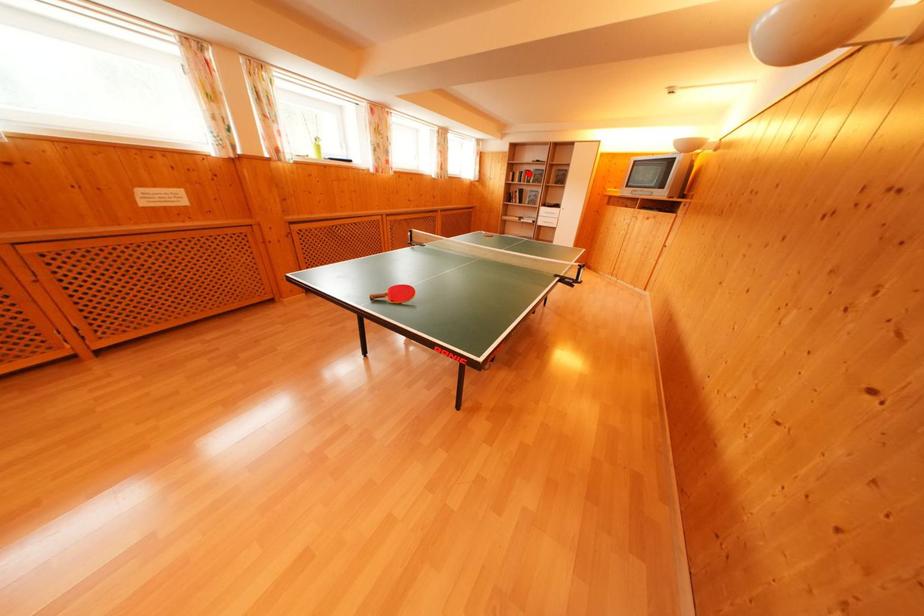
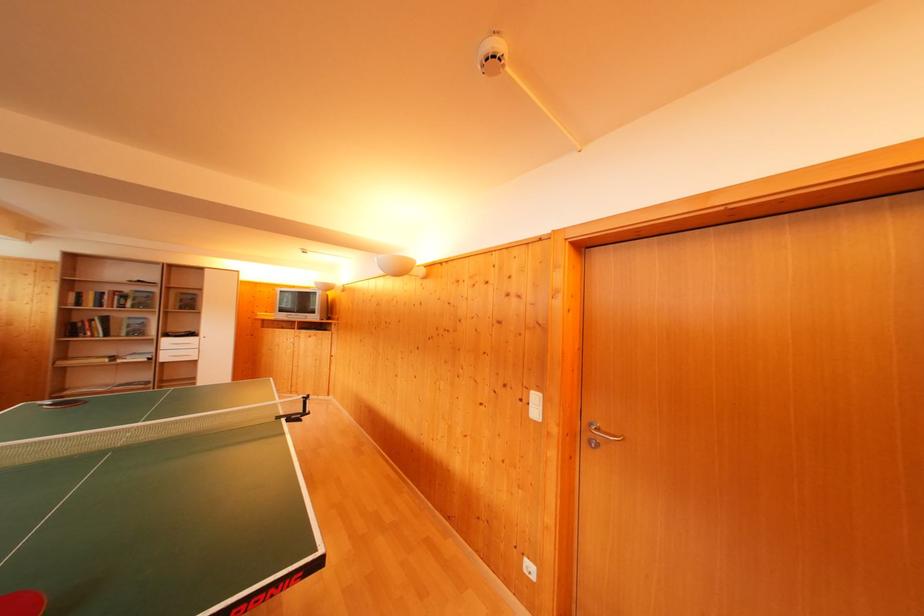
Find the pixel in the second image that matches the highlighted location in the first image.

(112, 294)